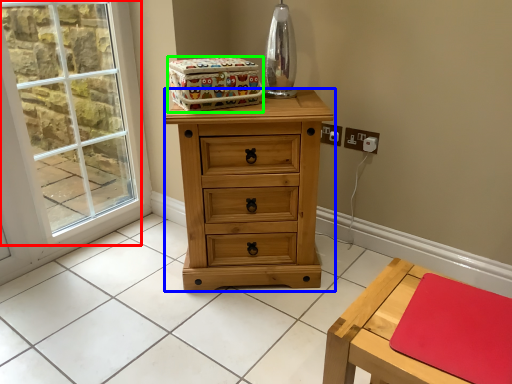
Question: Estimate the real-world distances between objects in this image. Which object is closer to window (highlighted by a red box), chest of drawers (highlighted by a blue box) or storage box (highlighted by a green box)?

Choices:
 (A) chest of drawers
 (B) storage box

Answer: (A)